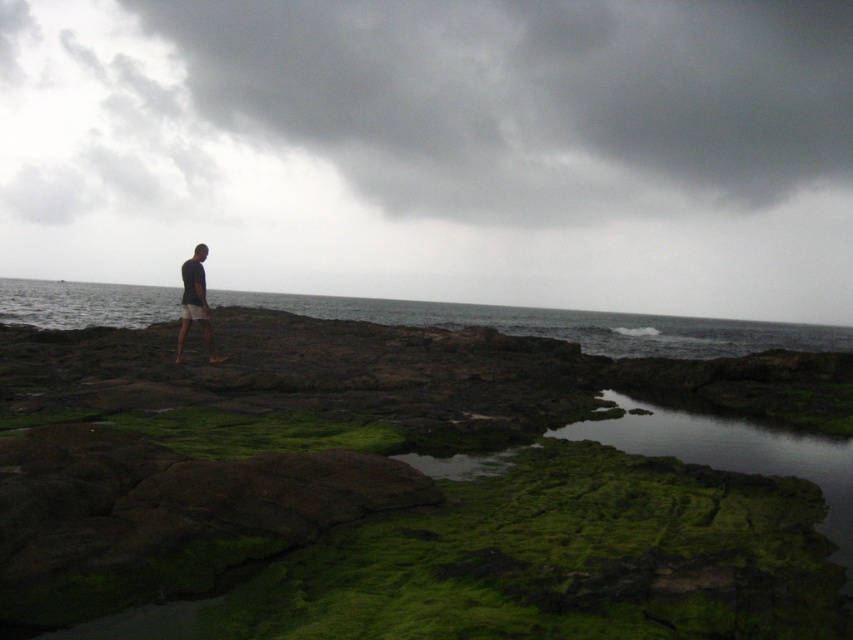
You are standing at the point marked as point [566,324] in the coastal scene. What is the color of the object you are standing on?

The gray water at center is located at point [566,324], so the color of the object you are standing on is gray.

You are standing at the edge of the coastal area and want to cross to the left side. The gray water at center is in your path. Based on its position, is there a way to go around it on the right side?

The gray water at center is located at point (566, 324), so yes, you can go around it on the right side since the water is centered and you can move along the right side of the coastal area to bypass it.

You are standing at the point closer to you in the coastal scene. Which point are you at, point (480, 321) or point (195, 268)?

You are at point (480, 321) because it is further to the viewer than point (195, 268).